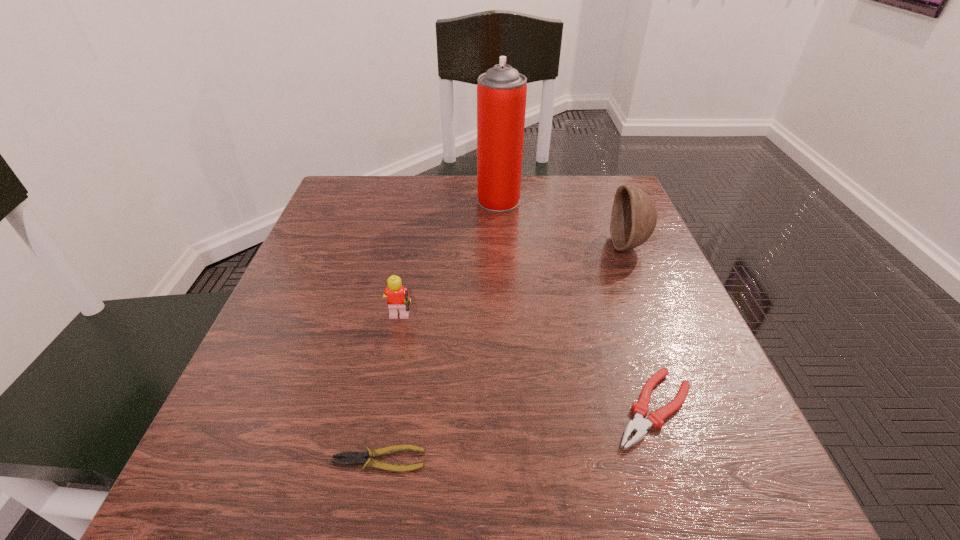
Image resolution: width=960 pixels, height=540 pixels. Identify the location of vacant space that satisfies the following two spatial constraints: 1. on the front side of the third object from left to right; 2. on the right side of the second tallest object. (501, 245).

I want to click on vacant space that satisfies the following two spatial constraints: 1. in front of the Lego with the accessory visible; 2. on the left side of the taller pliers, so click(x=383, y=409).

Identify the location of vacant region that satisfies the following two spatial constraints: 1. on the back side of the right pliers; 2. in front of the third shortest object with the accessory visible. The width and height of the screenshot is (960, 540). (624, 321).

The height and width of the screenshot is (540, 960). In order to click on free space that satisfies the following two spatial constraints: 1. on the front side of the second tallest object; 2. in front of the third farthest object with the accessory visible in this screenshot , I will do `click(660, 321)`.